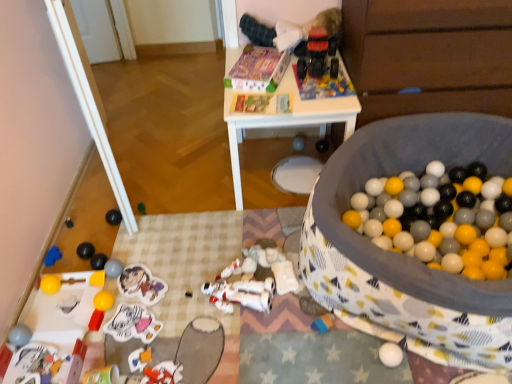
Question: Is rubberized red toy at lower left, which is counted as the eighth toy, starting from the left, further to the viewer compared to soft fabric ball pit at center, marked as the first toy in a right-to-left arrangement?

Choices:
 (A) no
 (B) yes

Answer: (B)

Question: Can you confirm if rubberized red toy at lower left, the 14th toy positioned from the right, is taller than soft fabric ball pit at center, the 21th toy from the left?

Choices:
 (A) yes
 (B) no

Answer: (B)

Question: Is rubberized red toy at lower left, which is counted as the eighth toy, starting from the left, located outside soft fabric ball pit at center, the 21th toy from the left?

Choices:
 (A) yes
 (B) no

Answer: (A)

Question: Considering the relative sizes of rubberized red toy at lower left, the 14th toy positioned from the right, and soft fabric ball pit at center, the 21th toy from the left, in the image provided, is rubberized red toy at lower left, the 14th toy positioned from the right, shorter than soft fabric ball pit at center, the 21th toy from the left,?

Choices:
 (A) no
 (B) yes

Answer: (B)

Question: Is rubberized red toy at lower left, which is counted as the eighth toy, starting from the left, not near soft fabric ball pit at center, the 21th toy from the left?

Choices:
 (A) no
 (B) yes

Answer: (B)

Question: In terms of size, does white matte robot at center, placed as the 7th toy when sorted from right to left, appear bigger or smaller than plastic toy at lower left, marked as the twelfth toy in a left-to-right arrangement?

Choices:
 (A) small
 (B) big

Answer: (B)

Question: Is white matte robot at center, placed as the 7th toy when sorted from right to left, to the left or to the right of plastic toy at lower left, marked as the twelfth toy in a left-to-right arrangement, in the image?

Choices:
 (A) right
 (B) left

Answer: (A)

Question: From their relative heights in the image, would you say white matte robot at center, marked as the fifteenth toy in a left-to-right arrangement, is taller or shorter than plastic toy at lower left, marked as the twelfth toy in a left-to-right arrangement?

Choices:
 (A) tall
 (B) short

Answer: (B)

Question: From the image's perspective, is white matte robot at center, placed as the 7th toy when sorted from right to left, positioned above or below plastic toy at lower left, marked as the tenth toy in a right-to-left arrangement?

Choices:
 (A) below
 (B) above

Answer: (B)

Question: From a real-world perspective, is matte gray ball at center, positioned as the eighteenth toy in left-to-right order, positioned above or below shiny black ball at lower left, which is the 16th toy from right to left?

Choices:
 (A) below
 (B) above

Answer: (B)

Question: Considering the relative positions of matte gray ball at center, which ranks as the fourth toy in right-to-left order, and shiny black ball at lower left, placed as the sixth toy when sorted from left to right, in the image provided, is matte gray ball at center, which ranks as the fourth toy in right-to-left order, to the left or to the right of shiny black ball at lower left, placed as the sixth toy when sorted from left to right,?

Choices:
 (A) right
 (B) left

Answer: (A)

Question: Choose the correct answer: Is matte gray ball at center, which ranks as the fourth toy in right-to-left order, inside shiny black ball at lower left, placed as the sixth toy when sorted from left to right, or outside it?

Choices:
 (A) outside
 (B) inside

Answer: (A)

Question: Is point (296, 148) positioned closer to the camera than point (91, 244)?

Choices:
 (A) closer
 (B) farther

Answer: (B)

Question: Does point (367, 125) appear closer or farther from the camera than point (303, 137)?

Choices:
 (A) farther
 (B) closer

Answer: (B)

Question: Considering the relative positions of soft fabric ball pit at center, the 21th toy from the left, and matte gray ball at center, which ranks as the fourth toy in right-to-left order, in the image provided, is soft fabric ball pit at center, the 21th toy from the left, to the left or to the right of matte gray ball at center, which ranks as the fourth toy in right-to-left order,?

Choices:
 (A) left
 (B) right

Answer: (B)